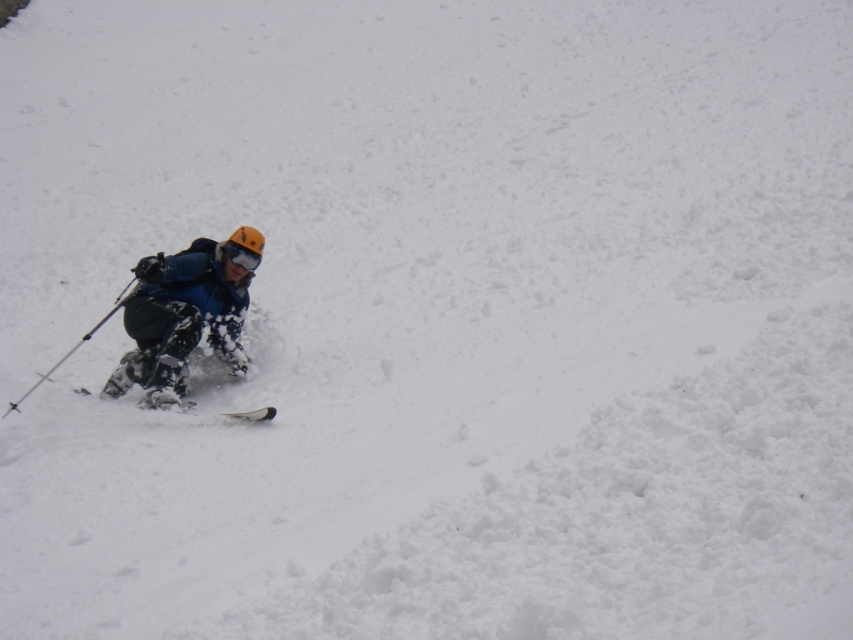
You are a professional skier planning to jump over a small gap between the matte black ski pole at left and the white matte ski at lower left. The gap is 1.48 meters wide. If your jump can cover 1.5 meters, will you make it?

Answer: The distance between the matte black ski pole at left and the white matte ski at lower left is 1.48 meters. Since your jump can cover 1.5 meters, you will successfully make the jump as the gap is slightly narrower than your maximum jump distance.